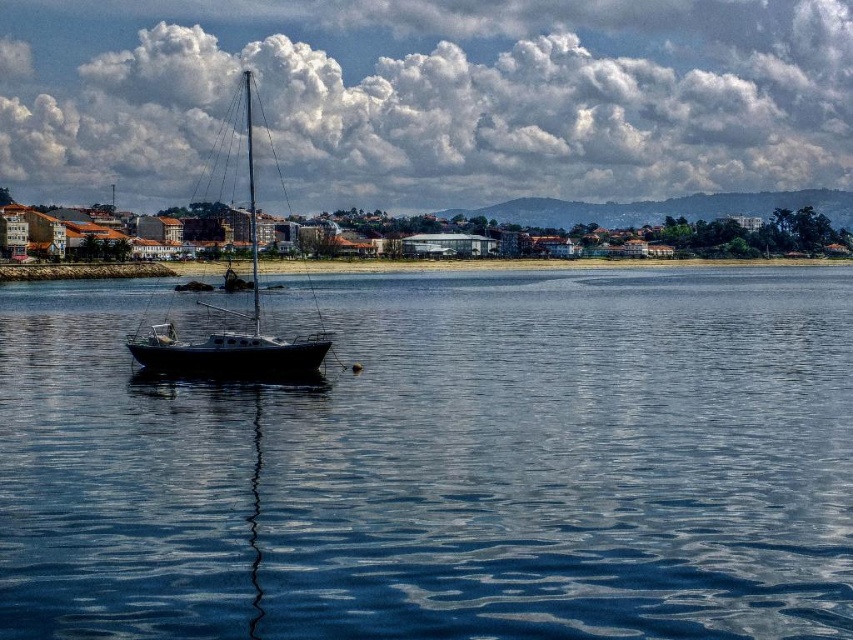
From the picture: Can you confirm if transparent blue water at center is taller than white fluffy cloud at upper center?

No.

What do you see at coordinates (444, 465) in the screenshot?
I see `transparent blue water at center` at bounding box center [444, 465].

Where is `transparent blue water at center`? The height and width of the screenshot is (640, 853). transparent blue water at center is located at coordinates (444, 465).

Does white fluffy cloud at upper center have a lesser width compared to shiny black sailboat at center?

Incorrect, white fluffy cloud at upper center's width is not less than shiny black sailboat at center's.

Who is more forward, (561, 13) or (183, 364)?

Point (183, 364)

Locate an element on the screen. This screenshot has height=640, width=853. white fluffy cloud at upper center is located at coordinates (434, 93).

This screenshot has height=640, width=853. Describe the element at coordinates (444, 465) in the screenshot. I see `transparent blue water at center` at that location.

Does transparent blue water at center lie in front of shiny black sailboat at center?

That is True.

Is point (260, 492) behind point (254, 332)?

No, (260, 492) is closer to viewer.

Locate an element on the screen. transparent blue water at center is located at coordinates [444, 465].